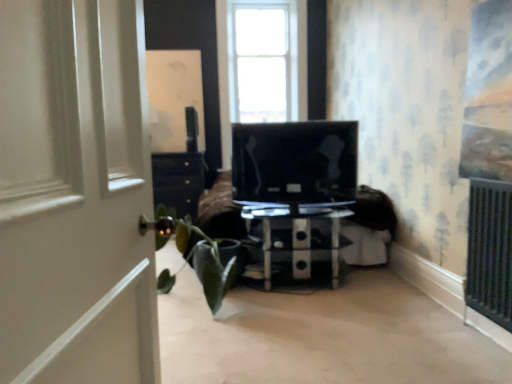
You are a GUI agent. You are given a task and a screenshot of the screen. Output one action in this format:
    pyautogui.click(x=<x>, y=<y>)
    Task: Click on the white wooden door at left
    Image resolution: width=512 pixels, height=384 pixels.
    Given the screenshot: What is the action you would take?
    pyautogui.click(x=75, y=195)

You are a GUI agent. You are given a task and a screenshot of the screen. Output one action in this format:
    pyautogui.click(x=<x>, y=<y>)
    Task: Click on the transparent glass coffee table at center
    The image size is (512, 384).
    Given the screenshot: What is the action you would take?
    pyautogui.click(x=298, y=238)

Find the location of a particular element. The image size is (512, 384). furniture that is below the white wooden door at left (from the image's perspective) is located at coordinates (298, 238).

From the image's perspective, who appears lower, transparent glass coffee table at center or white wooden door at left?

transparent glass coffee table at center.

Which is less distant, (257, 214) or (21, 2)?

Point (257, 214) is positioned farther from the camera compared to point (21, 2).

Is point (347, 212) closer or farther from the camera than point (212, 263)?

Point (347, 212).

How far apart are transparent glass coffee table at center and green matte houseplant at left?

transparent glass coffee table at center is 19.77 inches away from green matte houseplant at left.

Considering the sizes of objects transparent glass coffee table at center and green matte houseplant at left in the image provided, who is shorter, transparent glass coffee table at center or green matte houseplant at left?

With less height is transparent glass coffee table at center.

Does transparent glass coffee table at center appear on the right side of green matte houseplant at left?

Yes, transparent glass coffee table at center is to the right of green matte houseplant at left.

From the picture: Does green matte houseplant at left contain transparent glass coffee table at center?

Definitely not — transparent glass coffee table at center is not inside green matte houseplant at left.

Is green matte houseplant at left further to the viewer compared to transparent glass coffee table at center?

No, the depth of green matte houseplant at left is less than that of transparent glass coffee table at center.

Can you confirm if green matte houseplant at left is shorter than transparent glass coffee table at center?

No.

The image size is (512, 384). Identify the location of furniture located below the black glossy tv at center (from the image's perspective). (298, 238).

From the image's perspective, which object appears higher, black glossy tv at center or transparent glass coffee table at center?

black glossy tv at center, from the image's perspective.

How different are the orientations of black glossy tv at center and transparent glass coffee table at center in degrees?

170 degrees.

Locate an element on the screen. The height and width of the screenshot is (384, 512). houseplant below the white wooden door at left (from the image's perspective) is located at coordinates (208, 262).

Is the position of white wooden door at left more distant than that of green matte houseplant at left?

No, it is not.

Considering the positions of objects white wooden door at left and green matte houseplant at left in the image provided, who is more to the left, white wooden door at left or green matte houseplant at left?

green matte houseplant at left.

Is white wooden door at left a part of green matte houseplant at left?

No, green matte houseplant at left does not contain white wooden door at left.

In the scene shown: From a real-world perspective, is green matte houseplant at left on white wooden door at left?

Incorrect, from a real-world perspective, green matte houseplant at left is lower than white wooden door at left.

Is green matte houseplant at left smaller than white wooden door at left?

No, green matte houseplant at left is not smaller than white wooden door at left.

Are green matte houseplant at left and black glossy tv at center located far from each other?

Actually, green matte houseplant at left and black glossy tv at center are a little close together.

Considering the relative sizes of green matte houseplant at left and black glossy tv at center in the image provided, is green matte houseplant at left shorter than black glossy tv at center?

Yes, green matte houseplant at left is shorter than black glossy tv at center.

From the image's perspective, does green matte houseplant at left appear lower than black glossy tv at center?

Yes.

Is green matte houseplant at left thinner than black glossy tv at center?

No.

I want to click on door that appears in front of the transparent glass coffee table at center, so click(x=75, y=195).

In the image, there is a green matte houseplant at left. Identify the location of furniture below it (from the image's perspective). The image size is (512, 384). (298, 238).

Based on their spatial positions, is black glossy tv at center or green matte houseplant at left further from white wooden door at left?

black glossy tv at center is further to white wooden door at left.

Looking at the image, which one is located closer to white wooden door at left, green matte houseplant at left or transparent glass coffee table at center?

green matte houseplant at left lies closer to white wooden door at left than the other object.

Looking at the image, which one is located closer to black glossy tv at center, green matte houseplant at left or transparent glass coffee table at center?

The object closer to black glossy tv at center is transparent glass coffee table at center.

Which object lies nearer to the anchor point black glossy tv at center, transparent glass coffee table at center or white wooden door at left?

The object closer to black glossy tv at center is transparent glass coffee table at center.

Which object lies further to the anchor point transparent glass coffee table at center, white wooden door at left or black glossy tv at center?

white wooden door at left is further to transparent glass coffee table at center.

Considering their positions, is black glossy tv at center positioned further to green matte houseplant at left than transparent glass coffee table at center?

black glossy tv at center is positioned further to the anchor green matte houseplant at left.

Considering their positions, is white wooden door at left positioned closer to transparent glass coffee table at center than green matte houseplant at left?

The object closer to transparent glass coffee table at center is green matte houseplant at left.

Estimate the real-world distances between objects in this image. Which object is further from black glossy tv at center, transparent glass coffee table at center or green matte houseplant at left?

Among the two, green matte houseplant at left is located further to black glossy tv at center.

Locate an element on the screen. The width and height of the screenshot is (512, 384). houseplant positioned between white wooden door at left and black glossy tv at center from near to far is located at coordinates (208, 262).

The image size is (512, 384). Identify the location of entertainment center between green matte houseplant at left and transparent glass coffee table at center in the horizontal direction. (295, 176).

Where is `houseplant located between white wooden door at left and transparent glass coffee table at center in the depth direction`? houseplant located between white wooden door at left and transparent glass coffee table at center in the depth direction is located at coordinates (208, 262).

Find the location of a particular element. Image resolution: width=512 pixels, height=384 pixels. entertainment center between white wooden door at left and transparent glass coffee table at center in the front-back direction is located at coordinates (295, 176).